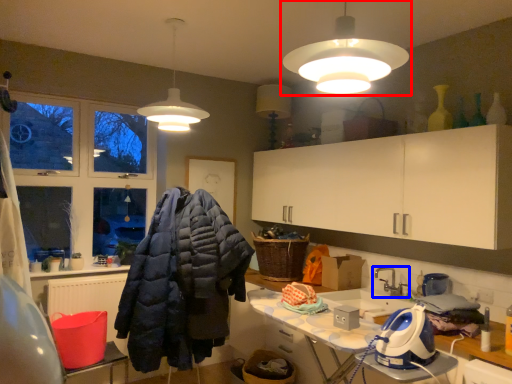
Question: Among these objects, which one is nearest to the camera, lamp (highlighted by a red box) or tap (highlighted by a blue box)?

Choices:
 (A) lamp
 (B) tap

Answer: (A)